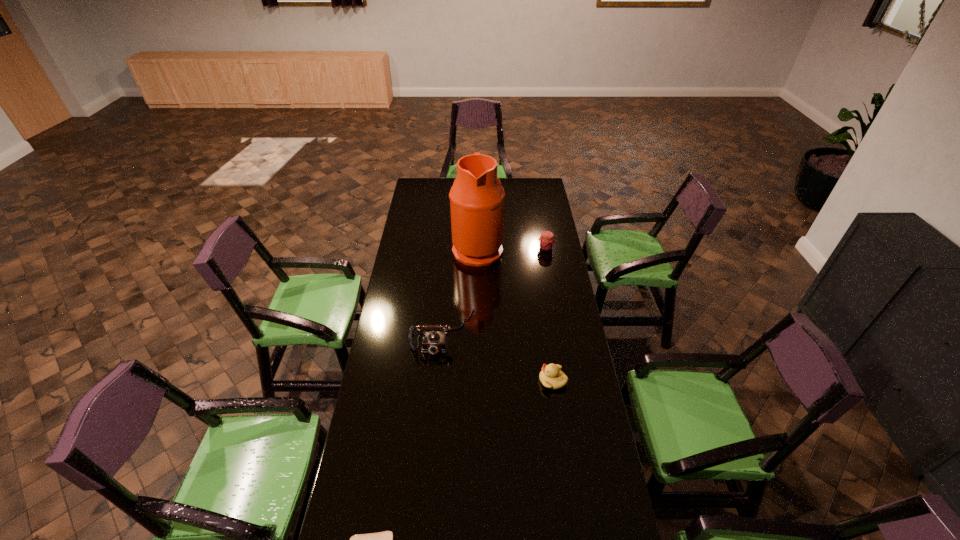
Find the location of a particular element. The height and width of the screenshot is (540, 960). vacant space located on the beak of the fourth farthest object is located at coordinates (496, 381).

The height and width of the screenshot is (540, 960). In order to click on object present at the left edge in this screenshot , I will do `click(433, 342)`.

This screenshot has width=960, height=540. I want to click on jam that is at the right edge, so click(x=546, y=241).

Find the location of a particular element. This screenshot has width=960, height=540. duckling located at the right edge is located at coordinates (551, 376).

In order to click on free space at the far edge of the desktop in this screenshot , I will do `click(521, 190)`.

The image size is (960, 540). In order to click on vacant region at the left edge of the desktop in this screenshot , I will do `click(376, 456)`.

Locate an element on the screen. The height and width of the screenshot is (540, 960). vacant point at the right edge is located at coordinates (540, 275).

Where is `vacant area that lies between the fourth shortest object and the duckling`? This screenshot has width=960, height=540. vacant area that lies between the fourth shortest object and the duckling is located at coordinates (498, 356).

At what (x,y) coordinates should I click in order to perform the action: click on free spot between the telephone and the duckling. Please return your answer as a coordinate pair (x, y). This screenshot has height=540, width=960. Looking at the image, I should click on (498, 356).

In order to click on unoccupied position between the telephone and the fourth farthest object in this screenshot , I will do `click(498, 356)`.